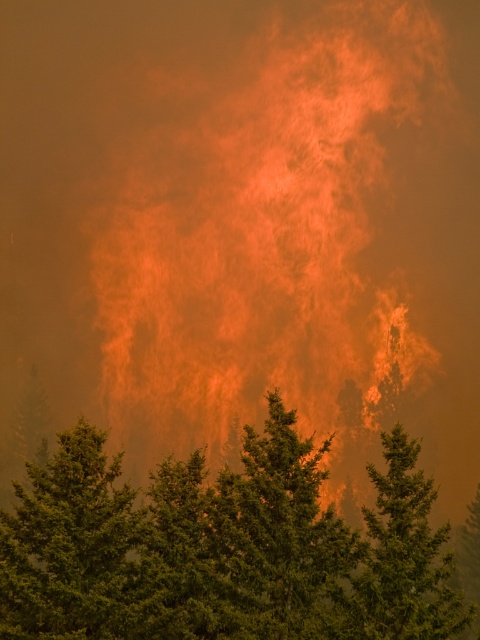
You are a firefighter assessing the scene. You see a green textured tree at center and a green textured pine tree at center. Which one has a wider base?

The green textured tree at center has a wider base than the green textured pine tree at center.